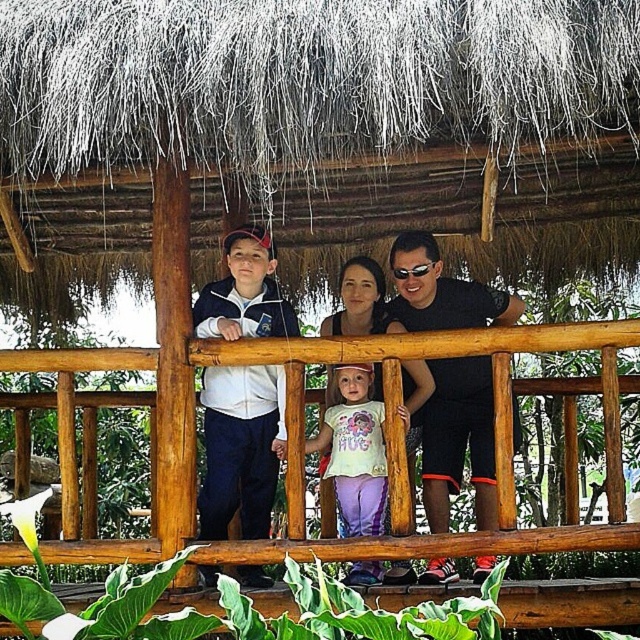
You are standing 5 meters away from the balcony. You want to throw a small ball to the black matte shirt at center. Can you reach them?

The black matte shirt at center is 6.25 meters away from the viewer. Since you are standing 5 meters away from the balcony, the total distance would be 5 meters plus the distance from the balcony to the black matte shirt. However, the given information specifies that the black matte shirt at center is already 6.25 meters from the viewer, so the ball cannot reach them as 5 meters is less than 6.25 meters.

You are standing on a balcony and want to hand a gift to the person wearing the black matte shirt at center. The gift is placed on the wooden at center. Based on their positions, will you need to move the gift to the right or left to reach the person?

The wooden at center is to the left of the black matte shirt at center. To reach the person wearing the black matte shirt at center, you would need to move the gift to the right from the wooden at center.

What is located at the coordinates point (x=458, y=440) in the image?

The black matte shirt at center is located at point (x=458, y=440).